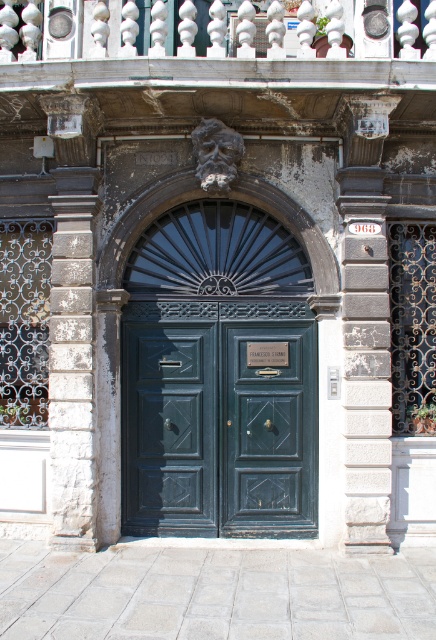
Question: Which of these objects is positioned farthest from the green matte door at center?

Choices:
 (A) green polished wood door at center
 (B) white marble railing at upper center
 (C) matte green door at center

Answer: (B)

Question: Can you confirm if green polished wood door at center is thinner than white stone column at left?

Choices:
 (A) no
 (B) yes

Answer: (A)

Question: Which point is closer to the camera?

Choices:
 (A) green polished wood door at center
 (B) green matte door at center
 (C) white stone column at left
 (D) white marble railing at upper center

Answer: (D)

Question: Can you confirm if green matte door at center is smaller than white stone column at left?

Choices:
 (A) yes
 (B) no

Answer: (B)

Question: Which of the following is the farthest from the observer?

Choices:
 (A) (302, 422)
 (B) (139, 417)
 (C) (60, 397)

Answer: (B)

Question: In this image, where is white marble railing at upper center located relative to matte green door at center?

Choices:
 (A) above
 (B) below

Answer: (A)